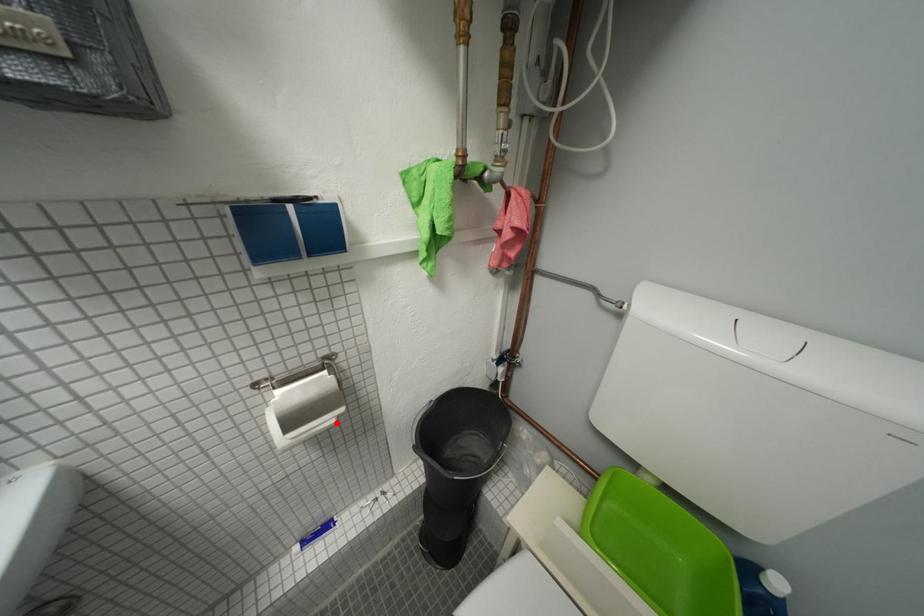
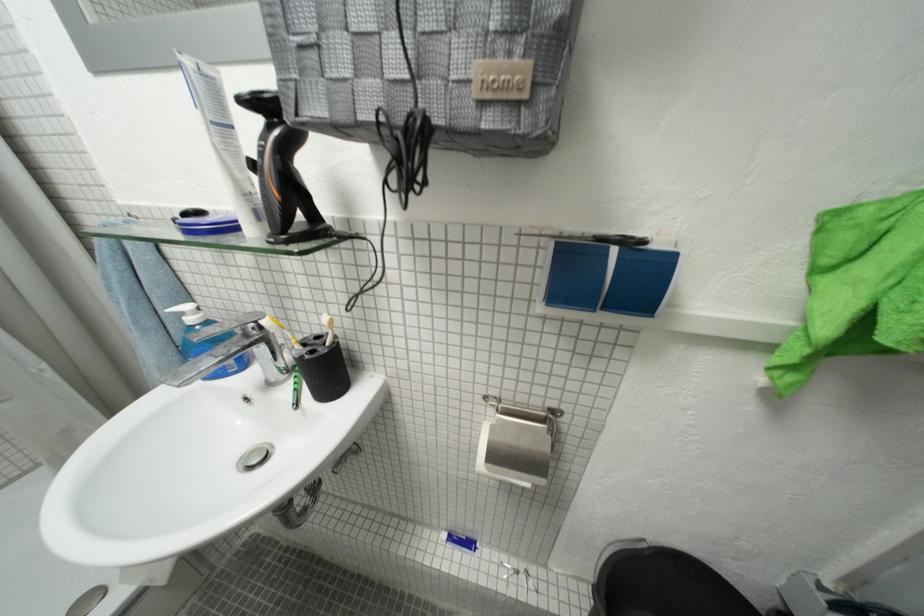
Locate, in the second image, the point that corresponds to the highlighted location in the first image.

(533, 483)